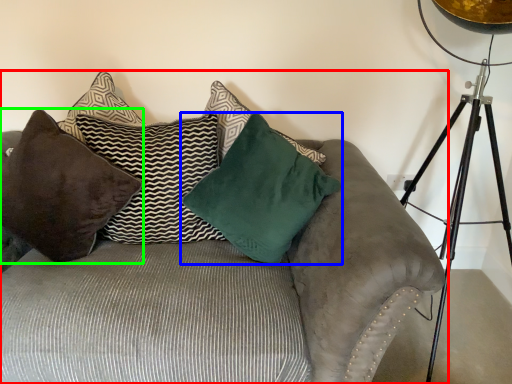
Question: Which object is positioned farthest from studio couch (highlighted by a red box)? Select from pillow (highlighted by a blue box) and pillow (highlighted by a green box).

Choices:
 (A) pillow
 (B) pillow

Answer: (A)